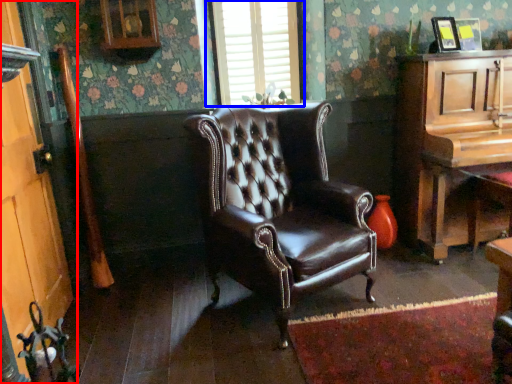
Question: Which of the following is the farthest to the observer, door (highlighted by a red box) or window (highlighted by a blue box)?

Choices:
 (A) door
 (B) window

Answer: (B)